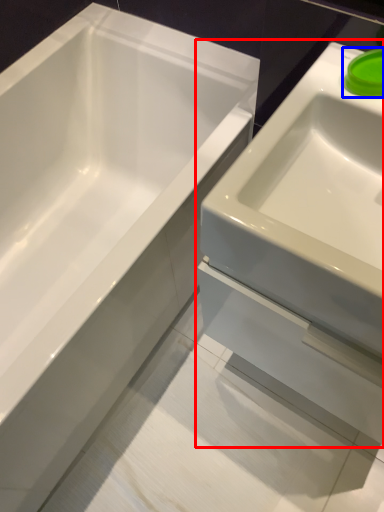
Question: Which point is further to the camera, sink (highlighted by a red box) or liquid (highlighted by a blue box)?

Choices:
 (A) sink
 (B) liquid

Answer: (B)